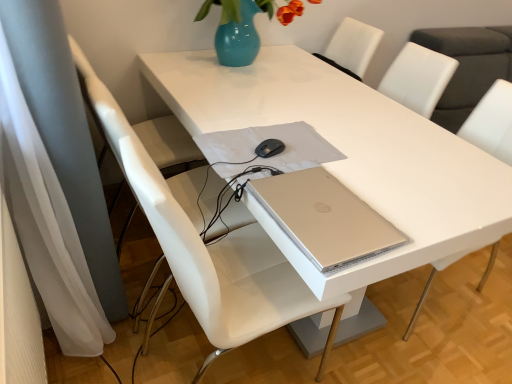
Question: Considering the relative positions of white plastic swivel chair at left and white leather chair at center, the first chair viewed from the left, in the image provided, is white plastic swivel chair at left to the left of white leather chair at center, the first chair viewed from the left, from the viewer's perspective?

Choices:
 (A) no
 (B) yes

Answer: (B)

Question: Is white plastic swivel chair at left closer to camera compared to white leather chair at center, the first chair viewed from the left?

Choices:
 (A) no
 (B) yes

Answer: (A)

Question: Is white plastic swivel chair at left aimed at white leather chair at center, the first chair viewed from the left?

Choices:
 (A) no
 (B) yes

Answer: (A)

Question: Can you confirm if white plastic swivel chair at left is bigger than white leather chair at center, marked as the second chair in a right-to-left arrangement?

Choices:
 (A) yes
 (B) no

Answer: (A)

Question: From a real-world perspective, does white plastic swivel chair at left stand above white leather chair at center, the first chair viewed from the left?

Choices:
 (A) yes
 (B) no

Answer: (A)

Question: Is white plastic swivel chair at left at the right side of white leather chair at center, the first chair viewed from the left?

Choices:
 (A) no
 (B) yes

Answer: (A)

Question: Considering the relative positions of white plastic swivel chair at left and silver metallic laptop at center in the image provided, is white plastic swivel chair at left to the left of silver metallic laptop at center from the viewer's perspective?

Choices:
 (A) yes
 (B) no

Answer: (A)

Question: From a real-world perspective, is white plastic swivel chair at left physically above silver metallic laptop at center?

Choices:
 (A) yes
 (B) no

Answer: (B)

Question: Is white plastic swivel chair at left shorter than silver metallic laptop at center?

Choices:
 (A) no
 (B) yes

Answer: (A)

Question: Is the position of white plastic swivel chair at left more distant than that of silver metallic laptop at center?

Choices:
 (A) no
 (B) yes

Answer: (B)

Question: Is white plastic swivel chair at left located outside silver metallic laptop at center?

Choices:
 (A) yes
 (B) no

Answer: (A)

Question: Considering the relative sizes of white plastic swivel chair at left and silver metallic laptop at center in the image provided, is white plastic swivel chair at left smaller than silver metallic laptop at center?

Choices:
 (A) no
 (B) yes

Answer: (A)

Question: From the image's perspective, is white glossy table at center located above white leather chair at center, marked as the second chair in a right-to-left arrangement?

Choices:
 (A) yes
 (B) no

Answer: (A)